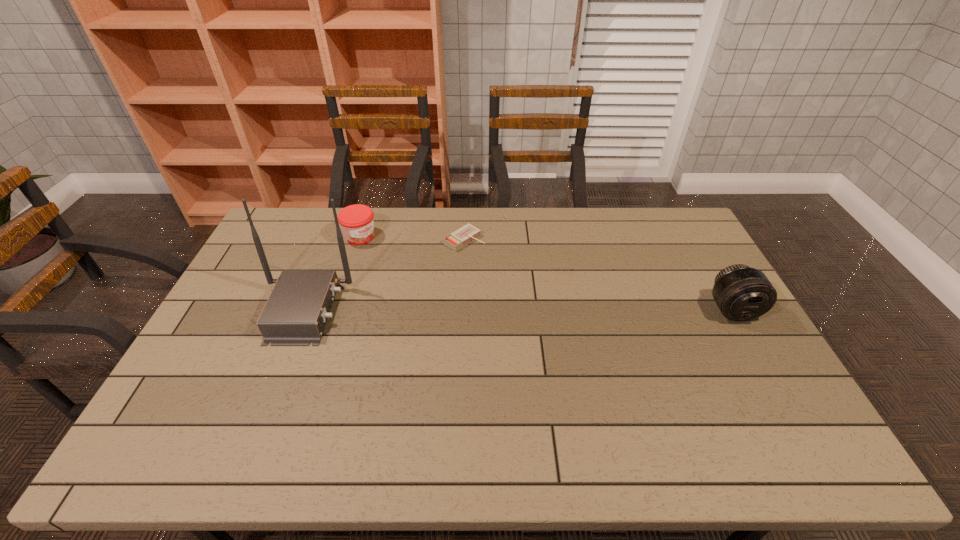
Identify the location of blank space at the left edge of the desktop. (256, 252).

Where is `free space at the right edge of the desktop`? free space at the right edge of the desktop is located at coordinates (674, 275).

Find the location of a particular element. free area in between the second object from right to left and the router is located at coordinates (384, 275).

Identify the location of unoccupied area between the router and the matchbox. (384, 275).

Identify the location of vacant area that lies between the matchbox and the telephoto lens. The height and width of the screenshot is (540, 960). click(x=598, y=275).

The image size is (960, 540). Find the location of `free point between the third tallest object and the shortest object`. free point between the third tallest object and the shortest object is located at coordinates (413, 238).

The image size is (960, 540). Identify the location of free space between the second object from right to left and the router. (384, 275).

The width and height of the screenshot is (960, 540). Identify the location of unoccupied position between the router and the matchbox. (384, 275).

Image resolution: width=960 pixels, height=540 pixels. I want to click on free spot between the third tallest object and the matchbox, so click(413, 238).

This screenshot has width=960, height=540. Find the location of `empty space between the matchbox and the router`. empty space between the matchbox and the router is located at coordinates (384, 275).